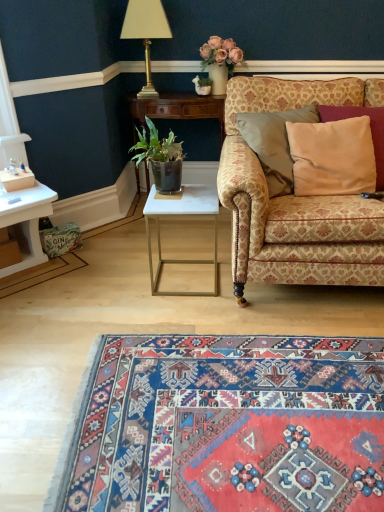
The height and width of the screenshot is (512, 384). What are the coordinates of `carpet with intricate patterns at lower center` in the screenshot? It's located at (229, 426).

Image resolution: width=384 pixels, height=512 pixels. What do you see at coordinates (294, 201) in the screenshot? I see `patterned fabric couch at right` at bounding box center [294, 201].

In order to face green leafy plant in dark pot at center, should I rotate leftwards or rightwards?

You should rotate left by 4.664 degrees.

Measure the distance between white glossy side table at center, the second table from the front, and camera.

The distance of white glossy side table at center, the second table from the front, from camera is 2.44 meters.

Locate an element on the screen. white marble table at center, the first table positioned from the bottom is located at coordinates (181, 219).

The image size is (384, 512). What do you see at coordinates (146, 33) in the screenshot?
I see `gold metallic lamp at upper center` at bounding box center [146, 33].

Find the location of a particular element. gold metallic lamp at upper center is located at coordinates (146, 33).

This screenshot has width=384, height=512. What are the coordinates of `carpet with intricate patterns at lower center` in the screenshot? It's located at (229, 426).

Considering the positions of point (304, 500) and point (318, 147), is point (304, 500) closer or farther from the camera than point (318, 147)?

Point (304, 500) is closer to the camera than point (318, 147).

Is carpet with intricate patterns at lower center far away from beige satin pillow at right?

carpet with intricate patterns at lower center is far away from beige satin pillow at right.

From the image's perspective, between carpet with intricate patterns at lower center and beige satin pillow at right, who is located below?

carpet with intricate patterns at lower center is shown below in the image.

Would you say carpet with intricate patterns at lower center is to the left or to the right of beige satin pillow at right in the picture?

carpet with intricate patterns at lower center is to the left of beige satin pillow at right.

Consider the image. Is green leafy plant in dark pot at center in front of or behind carpet with intricate patterns at lower center in the image?

Clearly, green leafy plant in dark pot at center is behind carpet with intricate patterns at lower center.

Considering the sizes of objects green leafy plant in dark pot at center and carpet with intricate patterns at lower center in the image provided, who is wider, green leafy plant in dark pot at center or carpet with intricate patterns at lower center?

carpet with intricate patterns at lower center is wider.

From the image's perspective, is green leafy plant in dark pot at center over carpet with intricate patterns at lower center?

Yes, from the image's perspective, green leafy plant in dark pot at center is over carpet with intricate patterns at lower center.

Could you tell me if green leafy plant in dark pot at center is facing gold metallic lamp at upper center?

No, green leafy plant in dark pot at center is not turned towards gold metallic lamp at upper center.

Is green leafy plant in dark pot at center not close to gold metallic lamp at upper center?

That's not correct — green leafy plant in dark pot at center is a little close to gold metallic lamp at upper center.

Who is bigger, green leafy plant in dark pot at center or gold metallic lamp at upper center?

With larger size is gold metallic lamp at upper center.

Is green leafy plant in dark pot at center wider or thinner than gold metallic lamp at upper center?

Considering their sizes, green leafy plant in dark pot at center looks slimmer than gold metallic lamp at upper center.

Who is shorter, green leafy plant in dark pot at center or white marble table at center, the 1th table viewed from the front?

With less height is green leafy plant in dark pot at center.

Measure the distance between green leafy plant in dark pot at center and white marble table at center, the first table positioned from the bottom.

green leafy plant in dark pot at center and white marble table at center, the first table positioned from the bottom, are 55.92 centimeters apart from each other.

From the image's perspective, is green leafy plant in dark pot at center above white marble table at center, the 1th table viewed from the front?

Yes, from the image's perspective, green leafy plant in dark pot at center is above white marble table at center, the 1th table viewed from the front.

Does point (174, 179) lie in front of point (202, 192)?

Yes, it is in front of point (202, 192).

Can white marble table at center, the 1th table viewed from the front, be found inside gold metallic lamp at upper center?

No, white marble table at center, the 1th table viewed from the front, is located outside of gold metallic lamp at upper center.

Considering the sizes of objects gold metallic lamp at upper center and white marble table at center, which is the second table in top-to-bottom order, in the image provided, who is thinner, gold metallic lamp at upper center or white marble table at center, which is the second table in top-to-bottom order,?

With smaller width is gold metallic lamp at upper center.

Is gold metallic lamp at upper center positioned in front of white marble table at center, which is the second table in top-to-bottom order?

No, gold metallic lamp at upper center is behind white marble table at center, which is the second table in top-to-bottom order.

From the picture: Who is smaller, gold metallic lamp at upper center or white marble table at center, the 1th table viewed from the front?

gold metallic lamp at upper center is smaller.

Is white glossy side table at center, the second table from the front, looking in the opposite direction of white marble table at center, the 1th table viewed from the front?

That's not correct — white glossy side table at center, the second table from the front, is not looking away from white marble table at center, the 1th table viewed from the front.

Which object is wider, white glossy side table at center, which ranks as the 1th table in back-to-front order, or white marble table at center, which is the second table in top-to-bottom order?

white marble table at center, which is the second table in top-to-bottom order.

Who is bigger, white glossy side table at center, the 1th table when ordered from top to bottom, or white marble table at center, the 1th table viewed from the front?

With larger size is white glossy side table at center, the 1th table when ordered from top to bottom.

In the scene shown: Which object is positioned more to the right, white glossy side table at center, the second table from the front, or white marble table at center, the 1th table viewed from the front?

white marble table at center, the 1th table viewed from the front.

Can you confirm if patterned fabric couch at right is wider than gold metallic lamp at upper center?

Yes.

How much distance is there between patterned fabric couch at right and gold metallic lamp at upper center?

They are 3.67 feet apart.

Does patterned fabric couch at right turn towards gold metallic lamp at upper center?

No.

Locate an element on the screen. The image size is (384, 512). studio couch that appears in front of the gold metallic lamp at upper center is located at coordinates (294, 201).

Where is `mat on the left of beige satin pillow at right`? Image resolution: width=384 pixels, height=512 pixels. mat on the left of beige satin pillow at right is located at coordinates (229, 426).

You are a GUI agent. You are given a task and a screenshot of the screen. Output one action in this format:
    pyautogui.click(x=<x>, y=<y>)
    Task: Click on the mat lying in front of the green leafy plant in dark pot at center
    The image size is (384, 512).
    Given the screenshot: What is the action you would take?
    pyautogui.click(x=229, y=426)

Looking at this image, based on their spatial positions, is white marble table at center, which is the second table from back to front, or green leafy plant in dark pot at center further from white glossy side table at center, acting as the second table starting from the bottom?

green leafy plant in dark pot at center lies further to white glossy side table at center, acting as the second table starting from the bottom, than the other object.

Estimate the real-world distances between objects in this image. Which object is closer to white marble table at center, which is the second table from back to front, green leafy plant in dark pot at center or beige satin pillow at right?

green leafy plant in dark pot at center is positioned closer to the anchor white marble table at center, which is the second table from back to front.

Estimate the real-world distances between objects in this image. Which object is further from beige satin pillow at right, white marble table at center, the 1th table viewed from the front, or gold metallic lamp at upper center?

gold metallic lamp at upper center is further to beige satin pillow at right.

Based on their spatial positions, is patterned fabric couch at right or white marble table at center, the first table positioned from the bottom, closer to carpet with intricate patterns at lower center?

Based on the image, patterned fabric couch at right appears to be nearer to carpet with intricate patterns at lower center.

When comparing their distances from green leafy plant in dark pot at center, does beige satin pillow at right or patterned fabric couch at right seem closer?

patterned fabric couch at right.

When comparing their distances from white glossy side table at center, the 1th table when ordered from top to bottom, does gold metallic lamp at upper center or carpet with intricate patterns at lower center seem closer?

gold metallic lamp at upper center is closer to white glossy side table at center, the 1th table when ordered from top to bottom.

Based on their spatial positions, is carpet with intricate patterns at lower center or beige satin pillow at right further from patterned fabric couch at right?

carpet with intricate patterns at lower center lies further to patterned fabric couch at right than the other object.

Looking at the image, which one is located closer to carpet with intricate patterns at lower center, white marble table at center, the first table positioned from the bottom, or patterned fabric couch at right?

patterned fabric couch at right is closer to carpet with intricate patterns at lower center.

Where is `studio couch between gold metallic lamp at upper center and white marble table at center, which is the second table in top-to-bottom order, in the up-down direction`? studio couch between gold metallic lamp at upper center and white marble table at center, which is the second table in top-to-bottom order, in the up-down direction is located at coordinates (294, 201).

Locate an element on the screen. Image resolution: width=384 pixels, height=512 pixels. houseplant between patterned fabric couch at right and white glossy side table at center, which ranks as the 1th table in back-to-front order, from front to back is located at coordinates (160, 158).

Where is `studio couch between gold metallic lamp at upper center and carpet with intricate patterns at lower center in the up-down direction`? studio couch between gold metallic lamp at upper center and carpet with intricate patterns at lower center in the up-down direction is located at coordinates (294, 201).

At what (x,y) coordinates should I click in order to perform the action: click on table between gold metallic lamp at upper center and white marble table at center, the first table positioned from the bottom, vertically. Please return your answer as a coordinate pair (x, y). This screenshot has width=384, height=512. Looking at the image, I should click on (184, 121).